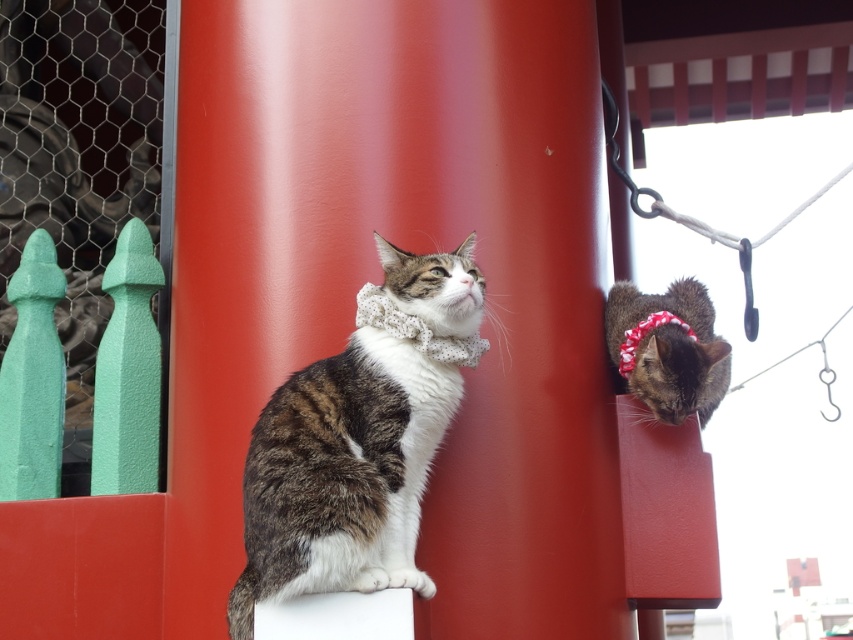
Question: Which object is farther from the camera taking this photo?

Choices:
 (A) smooth red pillar at center
 (B) tabby fur cat at upper right
 (C) tabby fur cat at center

Answer: (B)

Question: Is smooth red pillar at center above tabby fur cat at center?

Choices:
 (A) no
 (B) yes

Answer: (B)

Question: Does tabby fur cat at center appear under tabby fur cat at upper right?

Choices:
 (A) no
 (B) yes

Answer: (B)

Question: Which object is closer to the camera taking this photo?

Choices:
 (A) tabby fur cat at center
 (B) smooth red pillar at center

Answer: (A)

Question: Estimate the real-world distances between objects in this image. Which object is closer to the tabby fur cat at center?

Choices:
 (A) tabby fur cat at upper right
 (B) smooth red pillar at center

Answer: (B)

Question: Can you confirm if smooth red pillar at center is positioned to the right of tabby fur cat at center?

Choices:
 (A) no
 (B) yes

Answer: (B)